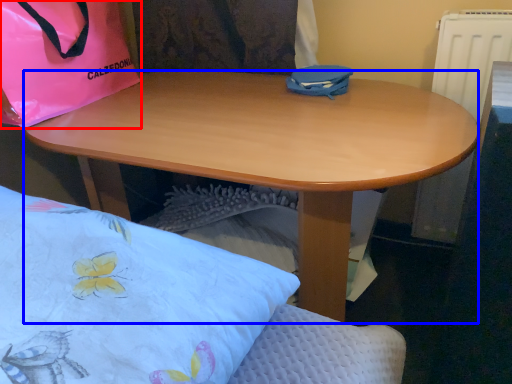
Question: Which point is further to the camera, handbag (highlighted by a red box) or desk (highlighted by a blue box)?

Choices:
 (A) handbag
 (B) desk

Answer: (A)